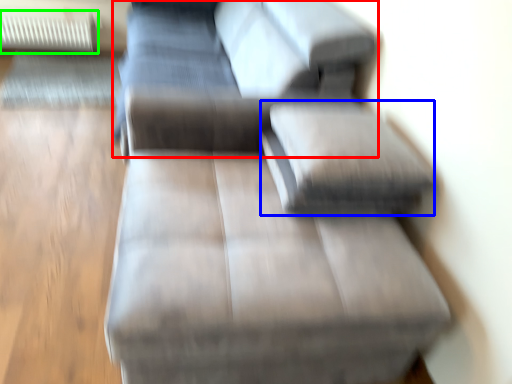
Question: Estimate the real-world distances between objects in this image. Which object is closer to couch (highlighted by a red box), pillow (highlighted by a blue box) or radiator (highlighted by a green box)?

Choices:
 (A) pillow
 (B) radiator

Answer: (A)